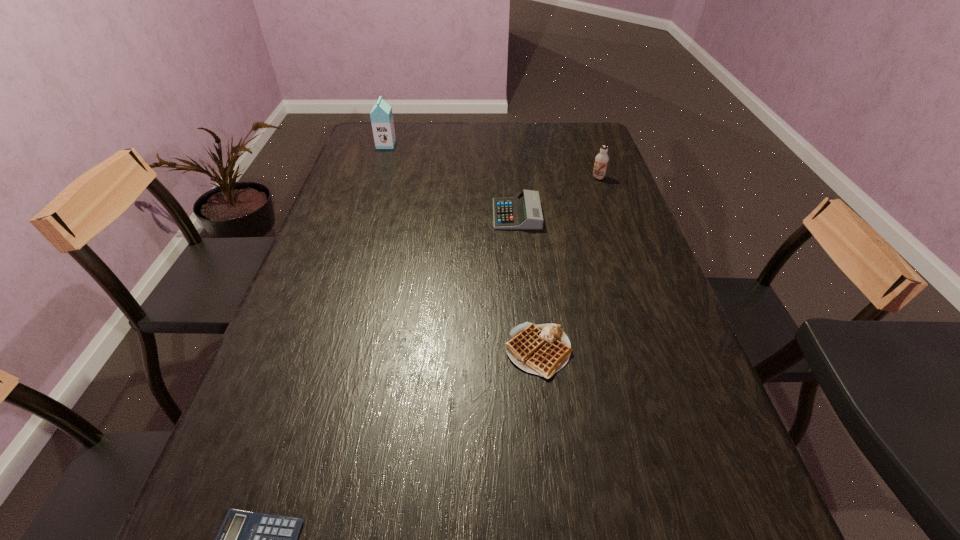
Where is `milk carton`? This screenshot has height=540, width=960. milk carton is located at coordinates (381, 116).

At what (x,y) coordinates should I click in order to perform the action: click on the farthest object. Please return your answer as a coordinate pair (x, y). Image resolution: width=960 pixels, height=540 pixels. Looking at the image, I should click on (381, 116).

In order to click on the rightmost object in this screenshot , I will do `click(601, 160)`.

Find the location of a particular element. chocolate milk is located at coordinates (601, 160).

The height and width of the screenshot is (540, 960). What are the coordinates of `the farther calculator` in the screenshot? It's located at click(x=523, y=212).

This screenshot has height=540, width=960. Identify the location of the right calculator. (523, 212).

The width and height of the screenshot is (960, 540). In order to click on waffle in this screenshot , I will do `click(543, 349)`.

I want to click on the fourth farthest object, so click(x=543, y=349).

Locate an element on the screen. free spot located on the right of the farthest object is located at coordinates (439, 145).

At what (x,y) coordinates should I click in order to perform the action: click on vacant region located 0.400m on the left of the chocolate milk. Please return your answer as a coordinate pair (x, y). The width and height of the screenshot is (960, 540). Looking at the image, I should click on (470, 178).